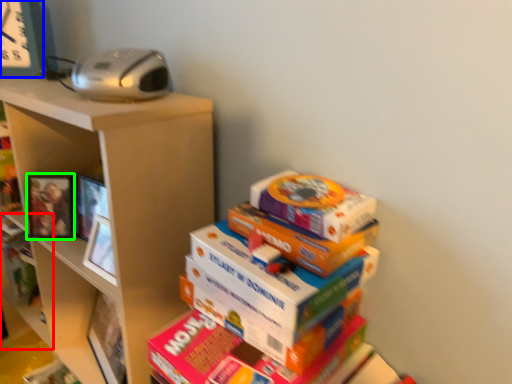
Question: Which object is the farthest from shelf (highlighted by a red box)? Choose among these: clock (highlighted by a blue box) or picture frame (highlighted by a green box).

Choices:
 (A) clock
 (B) picture frame

Answer: (A)